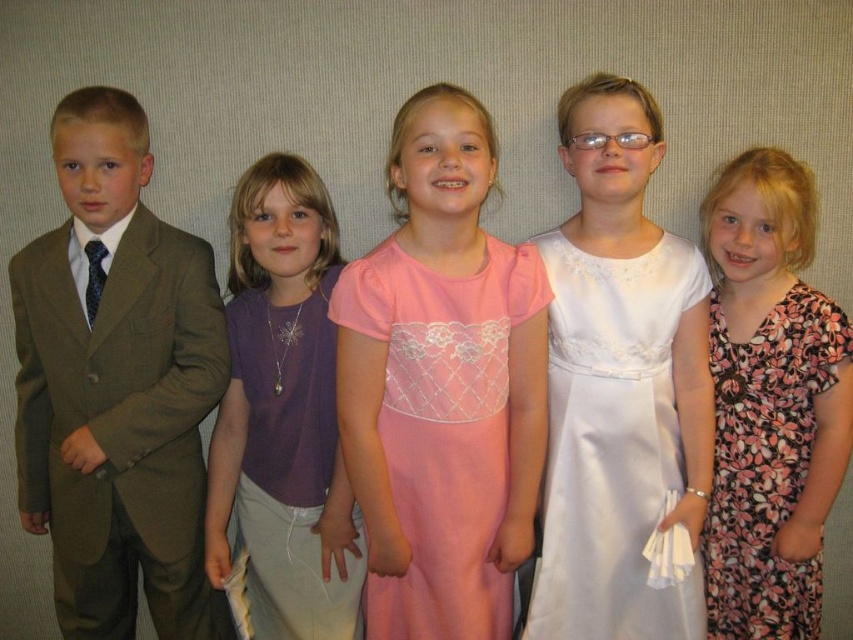
Which is above, matte brown suit at left or white satin dress at center?

matte brown suit at left is higher up.

Based on the photo, which of these two, matte brown suit at left or white satin dress at center, stands taller?

Standing taller between the two is matte brown suit at left.

This screenshot has width=853, height=640. Identify the location of matte brown suit at left. (115, 385).

Locate an element on the screen. The image size is (853, 640). matte brown suit at left is located at coordinates (115, 385).

Who is more forward, (305, 499) or (779, 333)?

Point (305, 499) is more forward.

Is the position of purple fabric shirt at center less distant than that of floral print dress at right?

Yes, purple fabric shirt at center is closer to the viewer.

Between point (228, 561) and point (735, 604), which one is positioned behind?

Point (735, 604)

Identify the location of purple fabric shirt at center. (283, 413).

Is point (331, 502) closer to camera compared to point (448, 612)?

No.

Who is more forward, (329, 323) or (447, 358)?

Point (447, 358) is more forward.

Which is behind, point (218, 502) or point (494, 384)?

The point (218, 502) is behind.

Image resolution: width=853 pixels, height=640 pixels. Identify the location of purple fabric shirt at center. (283, 413).